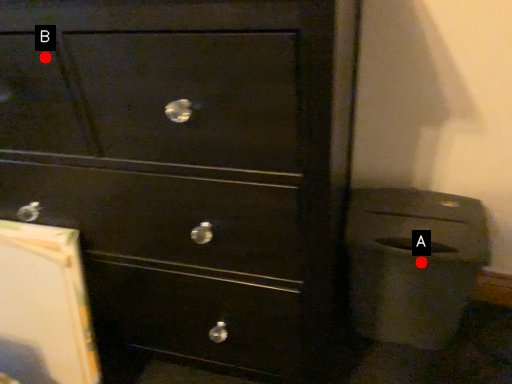
Question: Two points are circled on the image, labeled by A and B beside each circle. Which point is farther to the camera?

Choices:
 (A) A is further
 (B) B is further

Answer: (A)